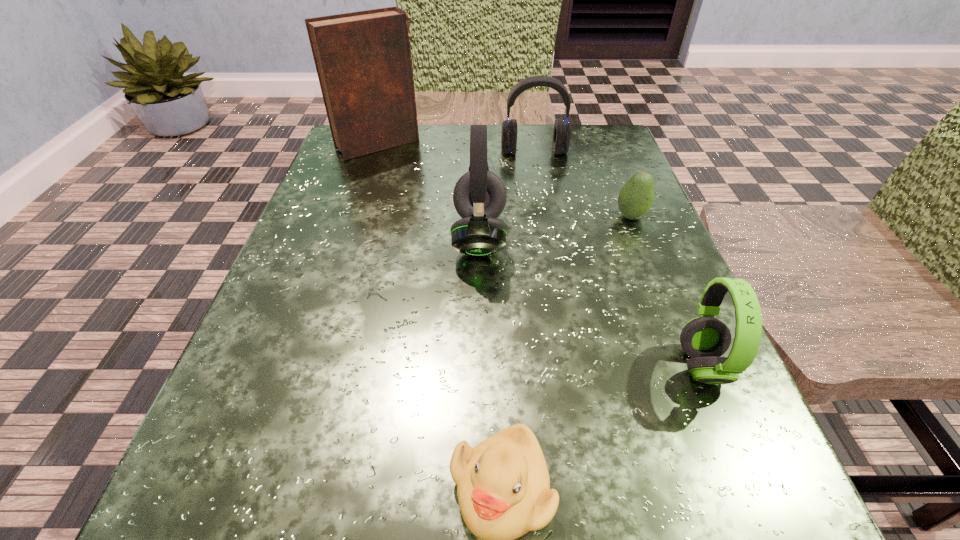
Locate an element on the screen. This screenshot has height=540, width=960. the leftmost object is located at coordinates (363, 59).

Find the location of a particular element. The image size is (960, 540). Bible is located at coordinates (363, 59).

At what (x,y) coordinates should I click in order to perform the action: click on the tallest headset. Please return your answer as a coordinate pair (x, y). This screenshot has width=960, height=540. Looking at the image, I should click on (479, 196).

Locate an element on the screen. Image resolution: width=960 pixels, height=540 pixels. the second tallest object is located at coordinates (479, 196).

This screenshot has width=960, height=540. Find the location of `the farthest headset`. the farthest headset is located at coordinates (562, 131).

Identify the location of the nearest headset. The image size is (960, 540). (704, 339).

The height and width of the screenshot is (540, 960). Find the location of `the rightmost headset`. the rightmost headset is located at coordinates (704, 339).

At what (x,y) coordinates should I click in order to perform the action: click on avocado. Please return your answer as a coordinate pair (x, y). The width and height of the screenshot is (960, 540). Looking at the image, I should click on (635, 199).

Where is `free space located on the right of the tallest object`? Image resolution: width=960 pixels, height=540 pixels. free space located on the right of the tallest object is located at coordinates (580, 145).

Where is `vacant area situated on the ear cups of the tallest headset`? The image size is (960, 540). vacant area situated on the ear cups of the tallest headset is located at coordinates (605, 237).